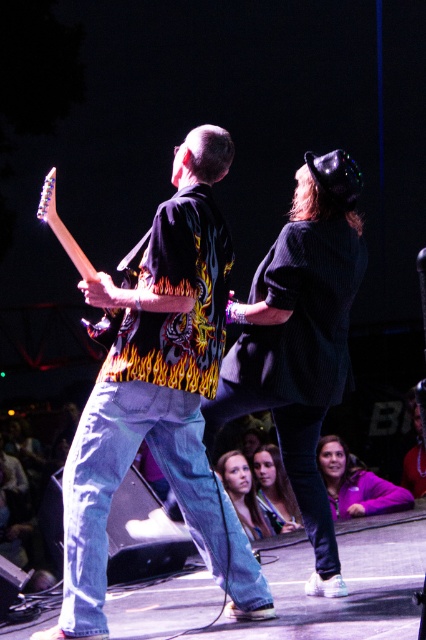
Between purple fleece jacket at lower center and wooden electric guitar at left, which one appears on the left side from the viewer's perspective?

From the viewer's perspective, wooden electric guitar at left appears more on the left side.

Is point (411, 504) closer to camera compared to point (94, 333)?

No, it is not.

Image resolution: width=426 pixels, height=640 pixels. What are the coordinates of `purple fleece jacket at lower center` in the screenshot? It's located at click(356, 483).

Which is in front, point (331, 470) or point (236, 492)?

Point (236, 492)

Who is higher up, purple fleece jacket at lower center or smooth skin face at center?

purple fleece jacket at lower center is above.

Who is more distant from viewer, [400,493] or [244,465]?

Positioned behind is point [244,465].

Locate an element on the screen. The height and width of the screenshot is (640, 426). purple fleece jacket at lower center is located at coordinates (356, 483).

Can you confirm if wooden electric guitar at left is wider than smooth skin face at center?

Incorrect, wooden electric guitar at left's width does not surpass smooth skin face at center's.

Is wooden electric guitar at left above smooth skin face at center?

Correct, wooden electric guitar at left is located above smooth skin face at center.

Describe the element at coordinates (63, 228) in the screenshot. I see `wooden electric guitar at left` at that location.

Locate an element on the screen. The width and height of the screenshot is (426, 640). wooden electric guitar at left is located at coordinates (63, 228).